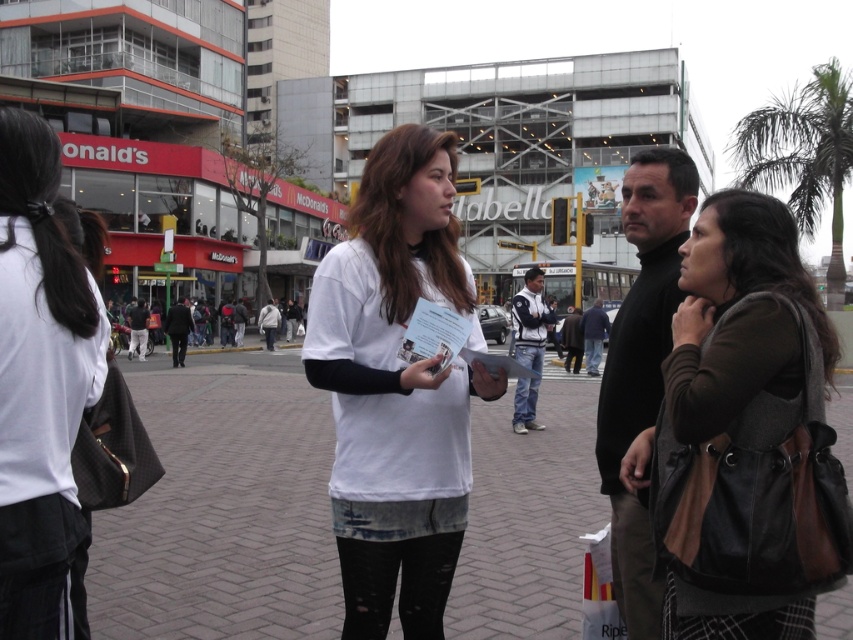
You are a delivery person who needs to pick up a package from the brown leather bag at right and deliver it to the dark gray coat at center. Can you reach the bag before the coat?

The brown leather bag at right is below the dark gray coat at center, so you can reach the bag before the coat.

Where is the brick pavement at center located in the image?

The brick pavement at center is located at point (223, 508).